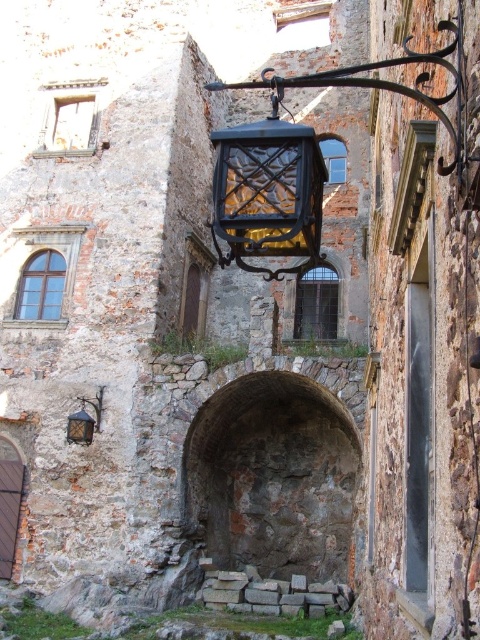
Is matte black lantern at center to the right of matte black lantern at lower left from the viewer's perspective?

Correct, you'll find matte black lantern at center to the right of matte black lantern at lower left.

The height and width of the screenshot is (640, 480). I want to click on matte black lantern at center, so click(x=267, y=188).

You are a GUI agent. You are given a task and a screenshot of the screen. Output one action in this format:
    pyautogui.click(x=<x>, y=<y>)
    Task: Click on the matte black lantern at center
    
    Given the screenshot: What is the action you would take?
    pyautogui.click(x=267, y=188)

Between rustic stone archway at center and matte black lantern at lower left, which one appears on the right side from the viewer's perspective?

Positioned to the right is rustic stone archway at center.

Find the location of `rustic stone archway at center`. rustic stone archway at center is located at coordinates (275, 477).

Which of these two, rustic stone archway at center or matte black lantern at center, stands shorter?

Standing shorter between the two is rustic stone archway at center.

Is point (263, 499) positioned behind point (264, 208)?

Yes, point (263, 499) is farther from viewer.

I want to click on rustic stone archway at center, so click(275, 477).